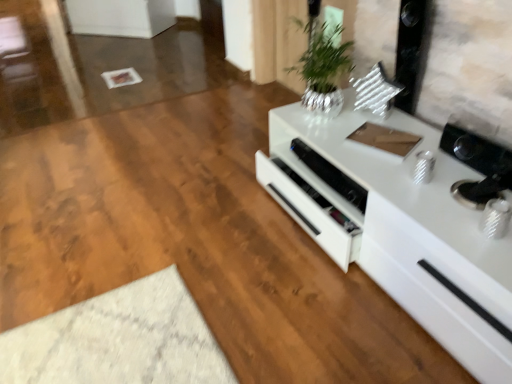
Identify the location of vacant space underneath silver metallic vase at upper center (from a real-world perspective). (318, 118).